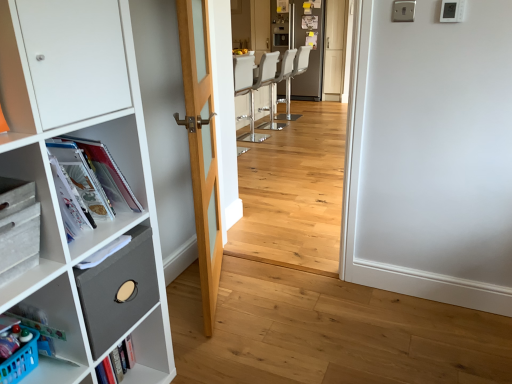
Question: From the image's perspective, is white leather bar stool at center, which appears as the 1th armchair when viewed from the back, below light wood floor at center?

Choices:
 (A) no
 (B) yes

Answer: (A)

Question: Is white leather bar stool at center, acting as the 2th armchair starting from the front, taller than light wood floor at center?

Choices:
 (A) yes
 (B) no

Answer: (B)

Question: Considering the relative sizes of white leather bar stool at center, acting as the 2th armchair starting from the front, and light wood floor at center in the image provided, is white leather bar stool at center, acting as the 2th armchair starting from the front, wider than light wood floor at center?

Choices:
 (A) no
 (B) yes

Answer: (B)

Question: Is white leather bar stool at center, acting as the 2th armchair starting from the front, shorter than light wood floor at center?

Choices:
 (A) yes
 (B) no

Answer: (A)

Question: Is white leather bar stool at center, acting as the 2th armchair starting from the front, positioned with its back to light wood floor at center?

Choices:
 (A) no
 (B) yes

Answer: (A)

Question: From the image's perspective, relative to matte plastic magazines at left, is white leather bar stool at center above or below?

Choices:
 (A) above
 (B) below

Answer: (A)

Question: Based on their sizes in the image, would you say white leather bar stool at center is bigger or smaller than matte plastic magazines at left?

Choices:
 (A) small
 (B) big

Answer: (B)

Question: Considering the positions of white leather bar stool at center and matte plastic magazines at left in the image, is white leather bar stool at center taller or shorter than matte plastic magazines at left?

Choices:
 (A) tall
 (B) short

Answer: (A)

Question: From a real-world perspective, is white leather bar stool at center physically located above or below matte plastic magazines at left?

Choices:
 (A) above
 (B) below

Answer: (B)

Question: Looking at their shapes, would you say light wood floor at center is wider or thinner than natural wood door at center?

Choices:
 (A) thin
 (B) wide

Answer: (A)

Question: In terms of height, does light wood floor at center look taller or shorter compared to natural wood door at center?

Choices:
 (A) tall
 (B) short

Answer: (A)

Question: In terms of size, does light wood floor at center appear bigger or smaller than natural wood door at center?

Choices:
 (A) big
 (B) small

Answer: (B)

Question: Does point (325, 170) appear closer or farther from the camera than point (202, 56)?

Choices:
 (A) farther
 (B) closer

Answer: (A)

Question: From a real-world perspective, is white leather bar stool at center, acting as the 2th armchair starting from the front, physically located above or below natural wood door at center?

Choices:
 (A) above
 (B) below

Answer: (B)

Question: From the image's perspective, is white leather bar stool at center, which appears as the 1th armchair when viewed from the back, positioned above or below natural wood door at center?

Choices:
 (A) below
 (B) above

Answer: (B)